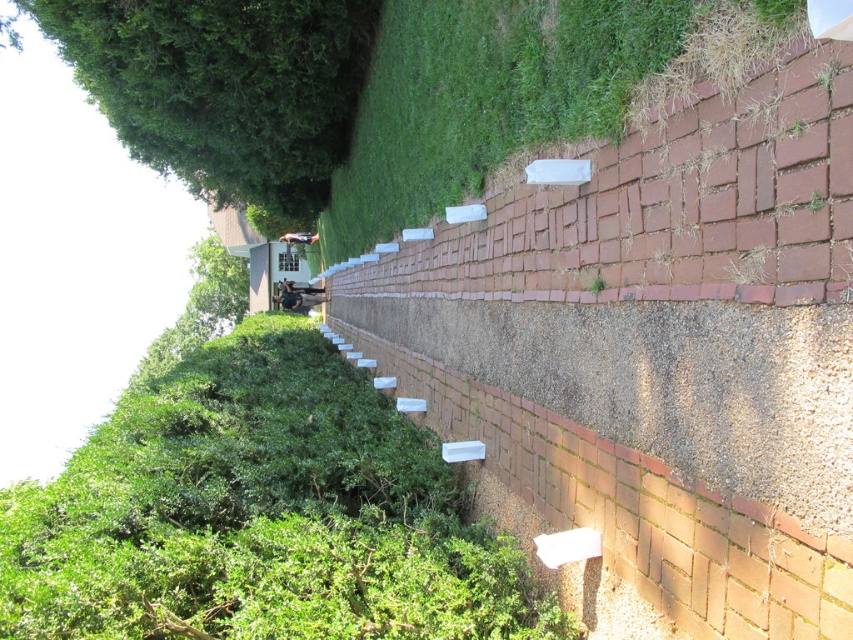
Question: Which of the following is the closest to the observer?

Choices:
 (A) green grass at center
 (B) dark gray fabric man at center
 (C) green leafy hedge at center
 (D) green leafy tree at upper left

Answer: (A)

Question: Can you confirm if green grass at center is positioned to the left of dark gray fabric man at center?

Choices:
 (A) yes
 (B) no

Answer: (B)

Question: Is green leafy tree at upper left bigger than dark gray fabric man at center?

Choices:
 (A) yes
 (B) no

Answer: (A)

Question: Estimate the real-world distances between objects in this image. Which object is farther from the dark gray fabric man at center?

Choices:
 (A) green leafy tree at upper left
 (B) green leafy hedge at center

Answer: (B)

Question: Is green grass at center in front of green leafy tree at upper left?

Choices:
 (A) yes
 (B) no

Answer: (A)

Question: Estimate the real-world distances between objects in this image. Which object is farther from the green leafy tree at upper left?

Choices:
 (A) dark gray fabric man at center
 (B) green leafy hedge at center

Answer: (A)